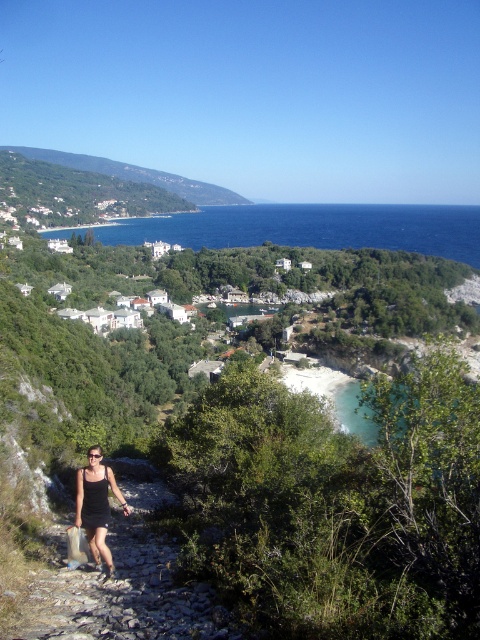
Between black gravel path at lower left and blue water at center, which one is positioned lower?

black gravel path at lower left is below.

The height and width of the screenshot is (640, 480). What are the coordinates of `black gravel path at lower left` in the screenshot? It's located at (123, 586).

Is black gravel path at lower left above black fabric dress at lower left?

Incorrect, black gravel path at lower left is not positioned above black fabric dress at lower left.

Can you confirm if black gravel path at lower left is shorter than black fabric dress at lower left?

Indeed, black gravel path at lower left has a lesser height compared to black fabric dress at lower left.

This screenshot has width=480, height=640. In order to click on black gravel path at lower left in this screenshot , I will do `click(123, 586)`.

Between blue water at center and black fabric dress at lower left, which one has more height?

blue water at center is taller.

Who is lower down, blue water at center or black fabric dress at lower left?

Positioned lower is black fabric dress at lower left.

Between point (355, 236) and point (94, 451), which one is positioned in front?

Point (94, 451) is in front.

At what (x,y) coordinates should I click in order to perform the action: click on blue water at center. Please return your answer as a coordinate pair (x, y). This screenshot has width=480, height=640. Looking at the image, I should click on (312, 227).